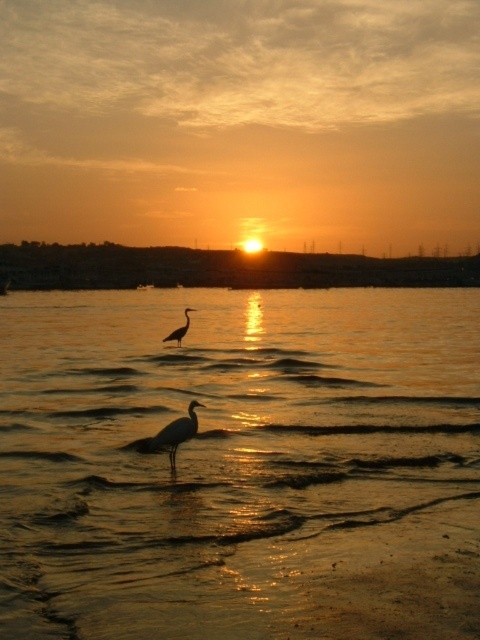
Question: Among these objects, which one is nearest to the camera?

Choices:
 (A) matte gray bird at center
 (B) golden reflective water at center

Answer: (B)

Question: Among these objects, which one is farthest from the camera?

Choices:
 (A) silvery white bird at center
 (B) golden reflective water at center
 (C) matte gray bird at center

Answer: (A)

Question: Which point is closer to the camera?

Choices:
 (A) (192, 428)
 (B) (313, 532)

Answer: (B)

Question: Does matte gray bird at center appear over silvery white bird at center?

Choices:
 (A) no
 (B) yes

Answer: (A)

Question: Can you confirm if golden reflective water at center is wider than silvery white bird at center?

Choices:
 (A) yes
 (B) no

Answer: (A)

Question: Is golden reflective water at center smaller than matte gray bird at center?

Choices:
 (A) yes
 (B) no

Answer: (B)